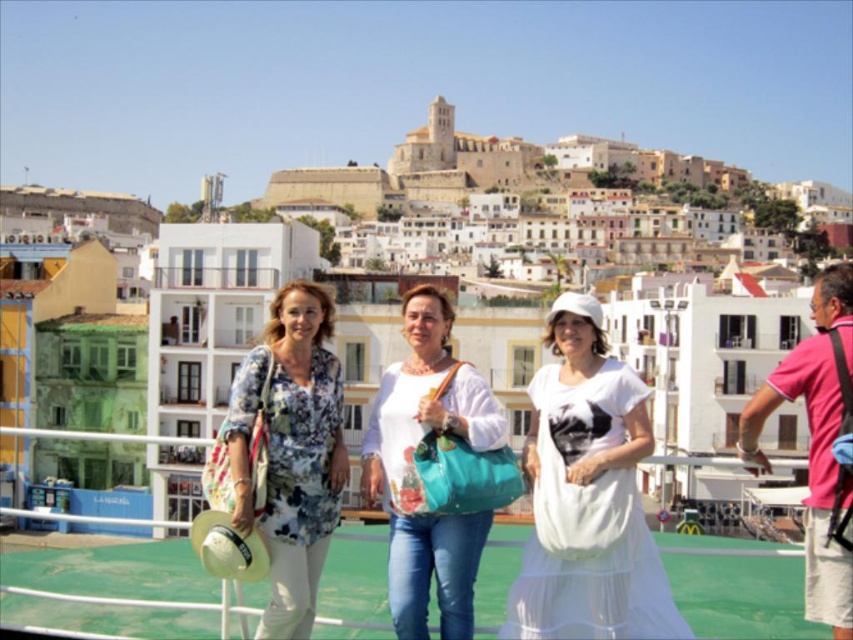
You are standing on the ferry deck and want to take a photo of both the point at coordinates (552, 464) and the point at coordinates (769, 390). Which point will appear larger in your photo?

Point at coordinates (552, 464) will appear larger in the photo because it is closer to the camera than point at coordinates (769, 390).

You are a photographer standing on the deck of the ferry. You want to take a photo of the white cotton dress at center and the pink cotton shirt at right. Your camera has a maximum focus range of 7 meters. Can you capture both subjects in focus without moving closer?

The distance between the white cotton dress at center and the pink cotton shirt at right is 7.41 meters. Since the camera can only focus up to 7 meters, it cannot capture both subjects in focus without moving closer.

You are a photographer standing on the deck of a ferry. You notice two items at the center of the scene, the white cotton dress at center and the white matte bag at center. Which item is closer to the photographer?

The white cotton dress at center is located below the white matte bag at center, meaning it is closer to the photographer since objects lower in the image are typically nearer.